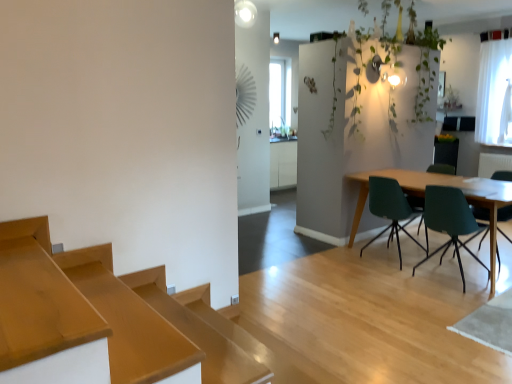
Question: Should I look upward or downward to see green matte chair at right, the fourth chair in the left-to-right sequence?

Choices:
 (A) down
 (B) up

Answer: (A)

Question: Would you say green matte chair at right, marked as the second chair in a right-to-left arrangement, is a long distance from matte green chair at right, arranged as the second chair when viewed from the left?

Choices:
 (A) yes
 (B) no

Answer: (A)

Question: Can you confirm if green matte chair at right, marked as the second chair in a right-to-left arrangement, is positioned to the left of matte green chair at right, arranged as the second chair when viewed from the left?

Choices:
 (A) yes
 (B) no

Answer: (B)

Question: Considering the relative sizes of green matte chair at right, marked as the second chair in a right-to-left arrangement, and matte green chair at right, marked as the 3th chair in a right-to-left arrangement, in the image provided, is green matte chair at right, marked as the second chair in a right-to-left arrangement, smaller than matte green chair at right, marked as the 3th chair in a right-to-left arrangement,?

Choices:
 (A) yes
 (B) no

Answer: (A)

Question: Is green matte chair at right, marked as the second chair in a right-to-left arrangement, taller than matte green chair at right, arranged as the second chair when viewed from the left?

Choices:
 (A) yes
 (B) no

Answer: (B)

Question: Does green matte chair at right, the 3th chair when ordered from left to right, have a greater width compared to matte green chair at right, arranged as the second chair when viewed from the left?

Choices:
 (A) yes
 (B) no

Answer: (A)

Question: Considering the relative sizes of green matte chair at right, the 3th chair when ordered from left to right, and matte green chair at right, arranged as the second chair when viewed from the left, in the image provided, is green matte chair at right, the 3th chair when ordered from left to right, thinner than matte green chair at right, arranged as the second chair when viewed from the left,?

Choices:
 (A) yes
 (B) no

Answer: (B)

Question: Is green leafy plant at upper right to the right of wooden table at right from the viewer's perspective?

Choices:
 (A) yes
 (B) no

Answer: (B)

Question: Does green leafy plant at upper right have a greater height compared to wooden table at right?

Choices:
 (A) yes
 (B) no

Answer: (A)

Question: Is there a large distance between green leafy plant at upper right and wooden table at right?

Choices:
 (A) no
 (B) yes

Answer: (B)

Question: Considering the relative positions of green leafy plant at upper right and wooden table at right in the image provided, is green leafy plant at upper right to the left of wooden table at right from the viewer's perspective?

Choices:
 (A) yes
 (B) no

Answer: (A)

Question: From the image's perspective, would you say green leafy plant at upper right is shown under wooden table at right?

Choices:
 (A) yes
 (B) no

Answer: (B)

Question: Does green leafy plant at upper right have a lesser height compared to wooden table at right?

Choices:
 (A) yes
 (B) no

Answer: (B)

Question: Is teal plastic chair at center right, which is the fourth chair from right to left, inside green matte chair at right, the first chair in the right-to-left sequence?

Choices:
 (A) no
 (B) yes

Answer: (A)